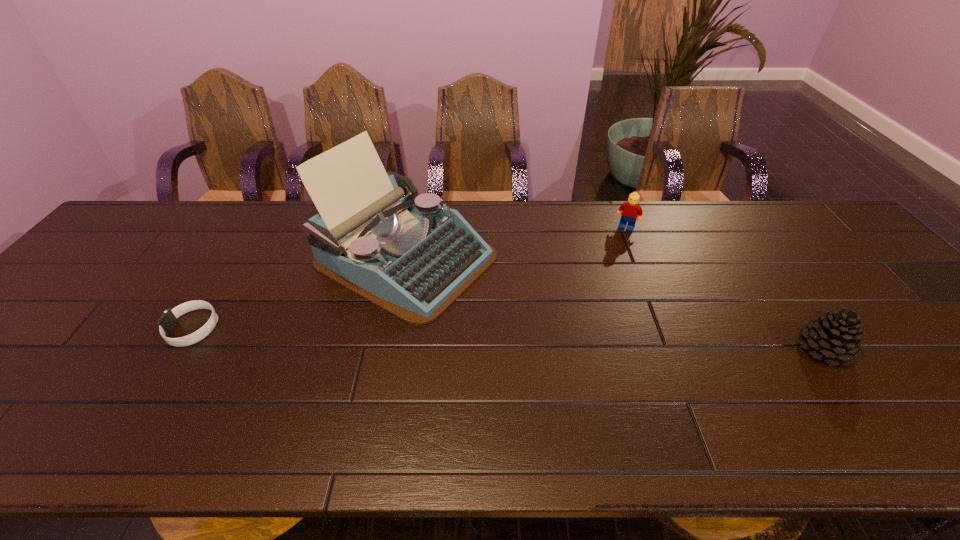
At what (x,y) coordinates should I click in order to perform the action: click on the shortest object. Please return your answer as a coordinate pair (x, y). Looking at the image, I should click on (168, 320).

Where is `the leftmost object`? The image size is (960, 540). the leftmost object is located at coordinates (168, 320).

At what (x,y) coordinates should I click in order to perform the action: click on pinecone. Please return your answer as a coordinate pair (x, y). Image resolution: width=960 pixels, height=540 pixels. Looking at the image, I should click on (837, 336).

Locate an element on the screen. typewriter is located at coordinates (374, 235).

Image resolution: width=960 pixels, height=540 pixels. What are the coordinates of `the second object from left to right` in the screenshot? It's located at (374, 235).

I want to click on the second object from right to left, so click(631, 211).

Where is `vacant space located 0.200m on the outer surface of the wristband`? vacant space located 0.200m on the outer surface of the wristband is located at coordinates point(86,329).

At what (x,y) coordinates should I click in order to perform the action: click on free space located 0.060m on the outer surface of the wristband. Please return your answer as a coordinate pair (x, y). This screenshot has width=960, height=540. Looking at the image, I should click on (144, 329).

This screenshot has width=960, height=540. What are the coordinates of `blank space located 0.250m on the outer surface of the wristband` in the screenshot? It's located at (66, 329).

Identify the location of free point located at the narrow end of the pinecone. The width and height of the screenshot is (960, 540). (678, 349).